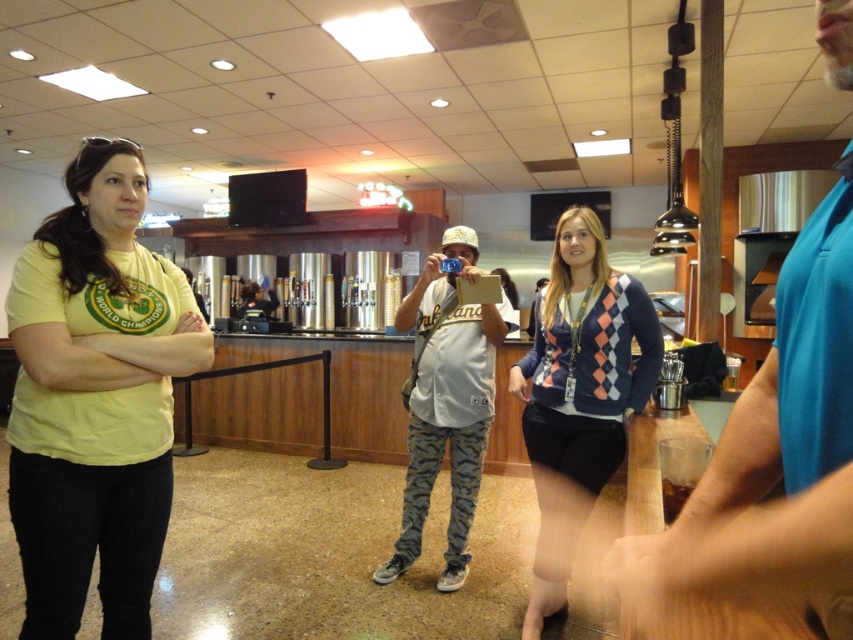
Is blue fabric shirt at center to the left of white cotton shirt at center from the viewer's perspective?

No, blue fabric shirt at center is not to the left of white cotton shirt at center.

Looking at this image, between blue fabric shirt at center and white cotton shirt at center, which one is positioned higher?

blue fabric shirt at center

What do you see at coordinates (773, 460) in the screenshot? Image resolution: width=853 pixels, height=640 pixels. I see `blue fabric shirt at center` at bounding box center [773, 460].

The height and width of the screenshot is (640, 853). I want to click on blue fabric shirt at center, so click(x=773, y=460).

Does blue fabric shirt at center appear over argyle sweater at center?

Indeed, blue fabric shirt at center is positioned over argyle sweater at center.

Can you confirm if blue fabric shirt at center is wider than argyle sweater at center?

Yes, blue fabric shirt at center is wider than argyle sweater at center.

The image size is (853, 640). Describe the element at coordinates (773, 460) in the screenshot. I see `blue fabric shirt at center` at that location.

Locate an element on the screen. The width and height of the screenshot is (853, 640). blue fabric shirt at center is located at coordinates (773, 460).

Between yellow matte t-shirt at left and white cotton shirt at center, which one has more height?

With more height is white cotton shirt at center.

Does point (199, 344) come closer to viewer compared to point (459, 477)?

Yes, it is.

Identify the location of yellow matte t-shirt at left. This screenshot has width=853, height=640. (96, 397).

Locate an element on the screen. yellow matte t-shirt at left is located at coordinates (96, 397).